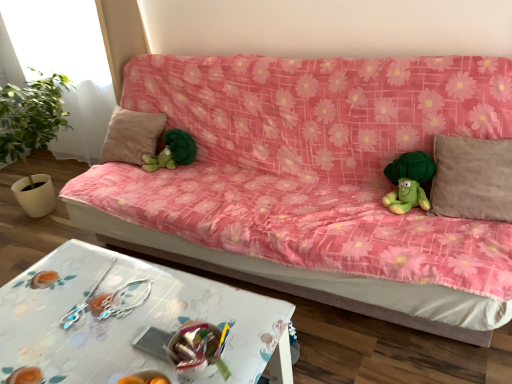
Identify the location of blank space to the left of silver metallic earrings at lower center. The height and width of the screenshot is (384, 512). (46, 293).